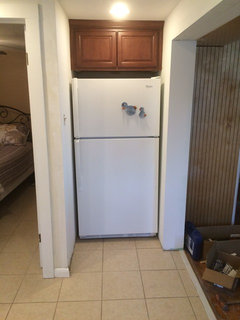
This screenshot has width=240, height=320. In order to click on light in this screenshot , I will do `click(122, 15)`.